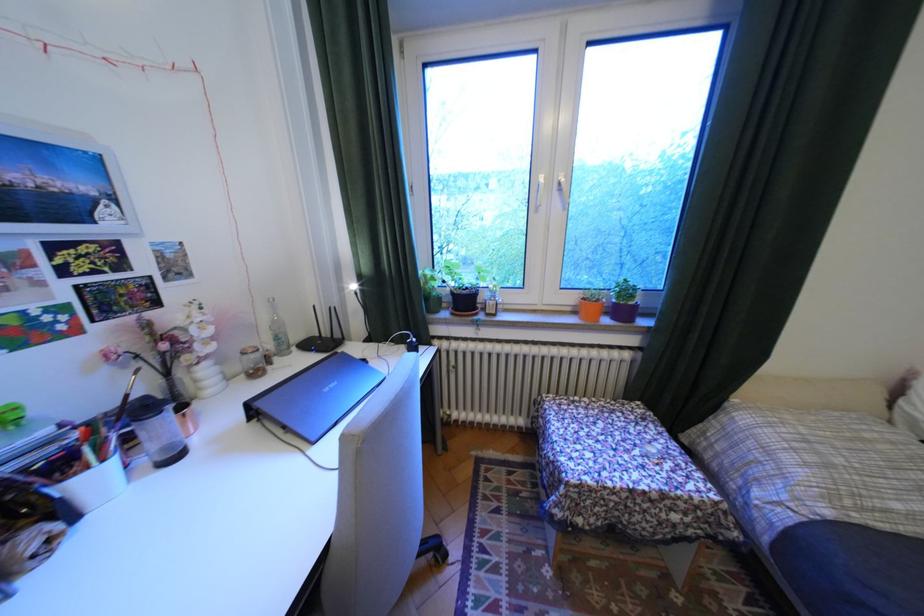
Find the location of `white pen holder`. white pen holder is located at coordinates (93, 482).